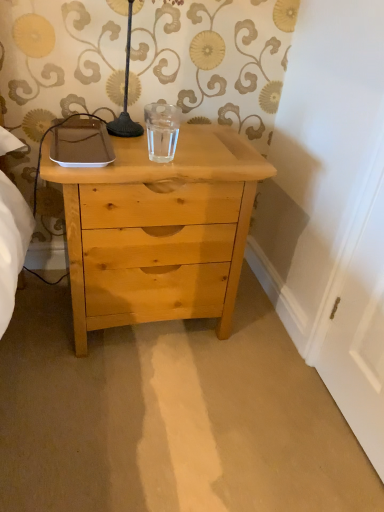
Image resolution: width=384 pixels, height=512 pixels. I want to click on vacant area on top of natural wood chest of drawers at center (from a real-world perspective), so click(158, 144).